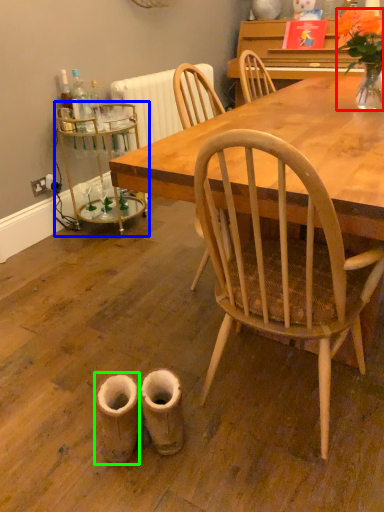
Question: Considering the real-world distances, which object is closest to houseplant (highlighted by a red box)? side table (highlighted by a blue box) or walking shoe (highlighted by a green box).

Choices:
 (A) side table
 (B) walking shoe

Answer: (A)